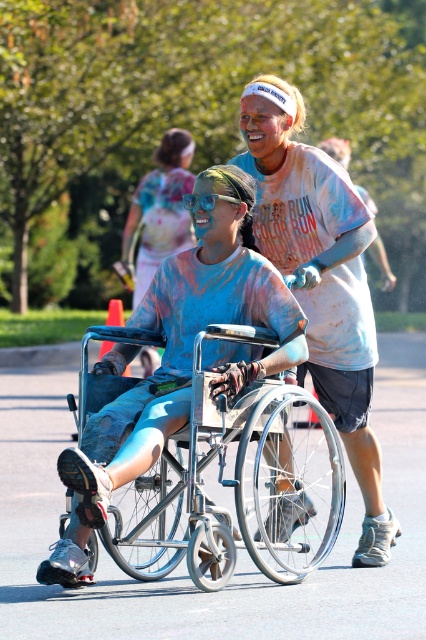
Is silver metallic wheelchair at center closer to camera compared to blue painted skin at center?

Yes, silver metallic wheelchair at center is closer to the viewer.

Based on the photo, can you confirm if silver metallic wheelchair at center is positioned below blue painted skin at center?

Yes, silver metallic wheelchair at center is below blue painted skin at center.

Where is `silver metallic wheelchair at center`? silver metallic wheelchair at center is located at coordinates (236, 484).

Between white cotton shirt at upper center and blue painted skin at center, which one appears on the right side from the viewer's perspective?

Positioned to the right is white cotton shirt at upper center.

Find the location of a particular element. The height and width of the screenshot is (640, 426). white cotton shirt at upper center is located at coordinates (321, 280).

Is silver metallic wheelchair at center smaller than white cotton shirt at upper center?

Incorrect, silver metallic wheelchair at center is not smaller in size than white cotton shirt at upper center.

Does silver metallic wheelchair at center appear on the left side of white cotton shirt at upper center?

Correct, you'll find silver metallic wheelchair at center to the left of white cotton shirt at upper center.

Between point (166, 506) and point (353, 360), which one is positioned in front?

Point (166, 506) is in front.

Identify the location of silver metallic wheelchair at center. The width and height of the screenshot is (426, 640). (236, 484).